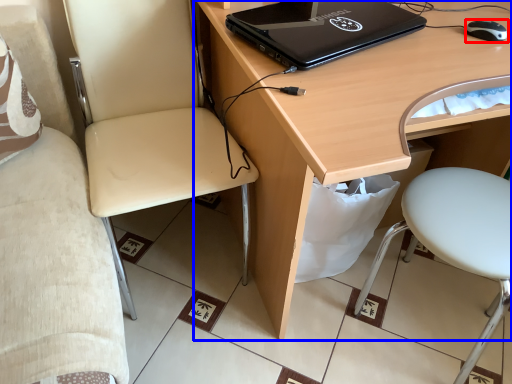
Question: Among these objects, which one is nearest to the camera, mouse (highlighted by a red box) or desk (highlighted by a blue box)?

Choices:
 (A) mouse
 (B) desk

Answer: (B)